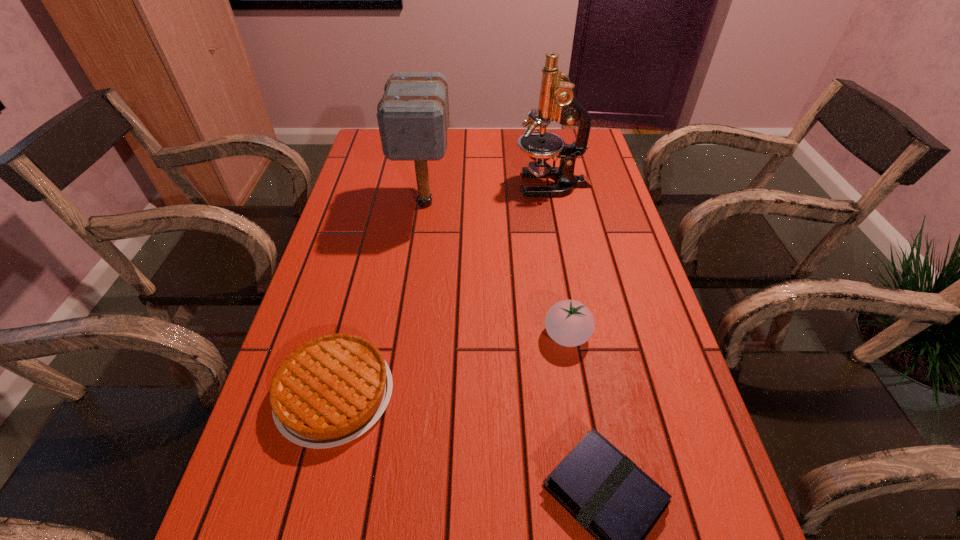
Where is `mallet that is positioned at the left edge`? This screenshot has height=540, width=960. mallet that is positioned at the left edge is located at coordinates (413, 115).

At what (x,y) coordinates should I click in order to perform the action: click on pie located at the left edge. Please return your answer as a coordinate pair (x, y). The image size is (960, 540). Looking at the image, I should click on (329, 391).

Image resolution: width=960 pixels, height=540 pixels. I want to click on microscope located in the right edge section of the desktop, so click(x=557, y=101).

Where is `tomato that is positioned at the right edge`? tomato that is positioned at the right edge is located at coordinates coord(570,323).

Find the location of `free region at the far edge`. free region at the far edge is located at coordinates (518, 130).

Locate an element on the screen. The image size is (960, 540). vacant space at the left edge of the desktop is located at coordinates (347, 266).

Find the location of a particular element. This screenshot has width=960, height=540. vacant space at the right edge of the desktop is located at coordinates (594, 204).

At what (x,y) coordinates should I click in order to perform the action: click on vacant space at the far left corner of the desktop. Please return your answer as a coordinate pair (x, y). The height and width of the screenshot is (540, 960). Looking at the image, I should click on (381, 143).

Image resolution: width=960 pixels, height=540 pixels. In the image, there is a desktop. In order to click on free space at the far right corner in this screenshot , I will do `click(587, 153)`.

At what (x,y) coordinates should I click in order to perform the action: click on vacant space that's between the mallet and the third shortest object. Please return your answer as a coordinate pair (x, y). This screenshot has height=540, width=960. Looking at the image, I should click on (496, 269).